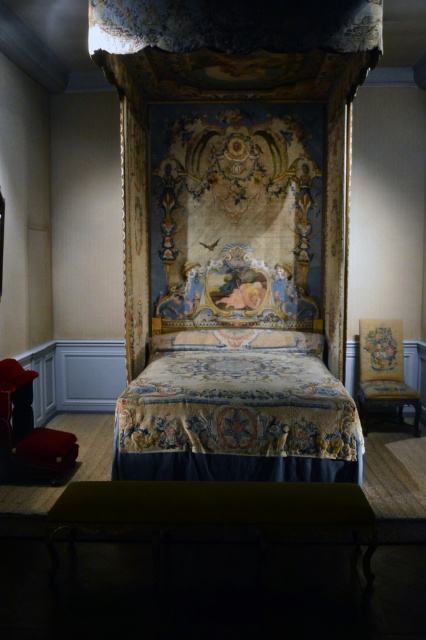
Question: Among these objects, which one is nearest to the camera?

Choices:
 (A) silky blue curtain at center
 (B) embroidered fabric bed at center
 (C) silky cream pillow at center
 (D) gold fabric chair at right

Answer: (B)

Question: Can you confirm if gold fabric chair at right is wider than silky cream pillow at center?

Choices:
 (A) yes
 (B) no

Answer: (B)

Question: Which point is closer to the camera?

Choices:
 (A) (146, 204)
 (B) (184, 349)
 (C) (175, 337)
 (D) (399, 420)

Answer: (B)

Question: Based on their relative distances, which object is nearer to the silky blue curtain at center?

Choices:
 (A) gold fabric chair at right
 (B) silky cream pillow at center
 (C) embroidered fabric bed at center

Answer: (B)

Question: Is gold fabric chair at right to the left of silky cream pillow at center from the viewer's perspective?

Choices:
 (A) no
 (B) yes

Answer: (A)

Question: Does gold fabric chair at right have a greater width compared to silky cream pillow at center?

Choices:
 (A) yes
 (B) no

Answer: (B)